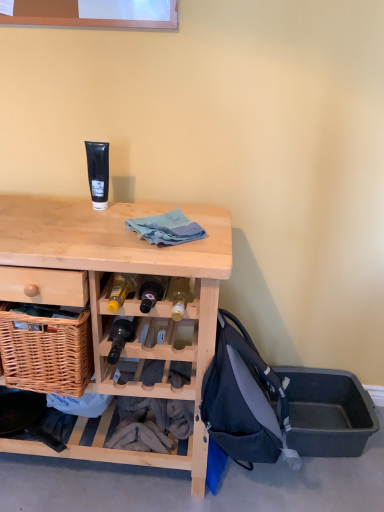
Question: Is dark blue fabric backpack at lower right taller than light wood desk at center?

Choices:
 (A) yes
 (B) no

Answer: (B)

Question: Can light wood desk at center be found inside dark blue fabric backpack at lower right?

Choices:
 (A) yes
 (B) no

Answer: (B)

Question: From the image's perspective, is dark blue fabric backpack at lower right on top of light wood desk at center?

Choices:
 (A) no
 (B) yes

Answer: (A)

Question: Is dark blue fabric backpack at lower right bigger than light wood desk at center?

Choices:
 (A) no
 (B) yes

Answer: (A)

Question: Is dark blue fabric backpack at lower right at the left side of light wood desk at center?

Choices:
 (A) yes
 (B) no

Answer: (B)

Question: Would you say black matte tube at upper center is to the left or to the right of gray plastic storage box at lower right in the picture?

Choices:
 (A) left
 (B) right

Answer: (A)

Question: Would you say black matte tube at upper center is inside or outside gray plastic storage box at lower right?

Choices:
 (A) outside
 (B) inside

Answer: (A)

Question: In terms of height, does black matte tube at upper center look taller or shorter compared to gray plastic storage box at lower right?

Choices:
 (A) tall
 (B) short

Answer: (A)

Question: In terms of width, does black matte tube at upper center look wider or thinner when compared to gray plastic storage box at lower right?

Choices:
 (A) thin
 (B) wide

Answer: (A)

Question: From the image's perspective, relative to gray plastic storage box at lower right, is blue cotton cloth at center above or below?

Choices:
 (A) below
 (B) above

Answer: (B)

Question: Considering the positions of blue cotton cloth at center and gray plastic storage box at lower right in the image, is blue cotton cloth at center bigger or smaller than gray plastic storage box at lower right?

Choices:
 (A) big
 (B) small

Answer: (B)

Question: Is blue cotton cloth at center in front of or behind gray plastic storage box at lower right in the image?

Choices:
 (A) behind
 (B) front

Answer: (B)

Question: In terms of width, does blue cotton cloth at center look wider or thinner when compared to gray plastic storage box at lower right?

Choices:
 (A) wide
 (B) thin

Answer: (B)

Question: Looking at the image, does dark blue fabric backpack at lower right seem bigger or smaller compared to black matte tube at upper center?

Choices:
 (A) big
 (B) small

Answer: (A)

Question: From a real-world perspective, is dark blue fabric backpack at lower right above or below black matte tube at upper center?

Choices:
 (A) above
 (B) below

Answer: (B)